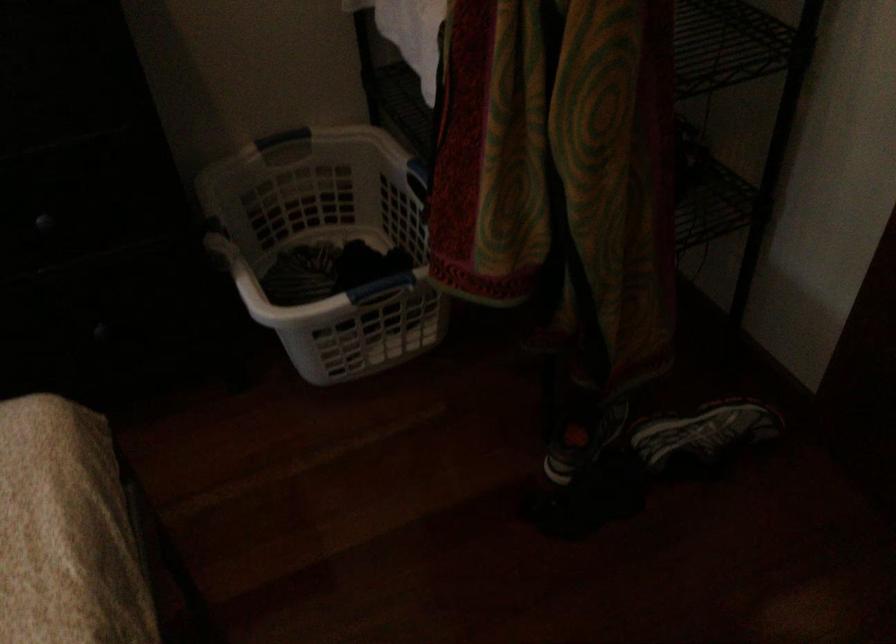
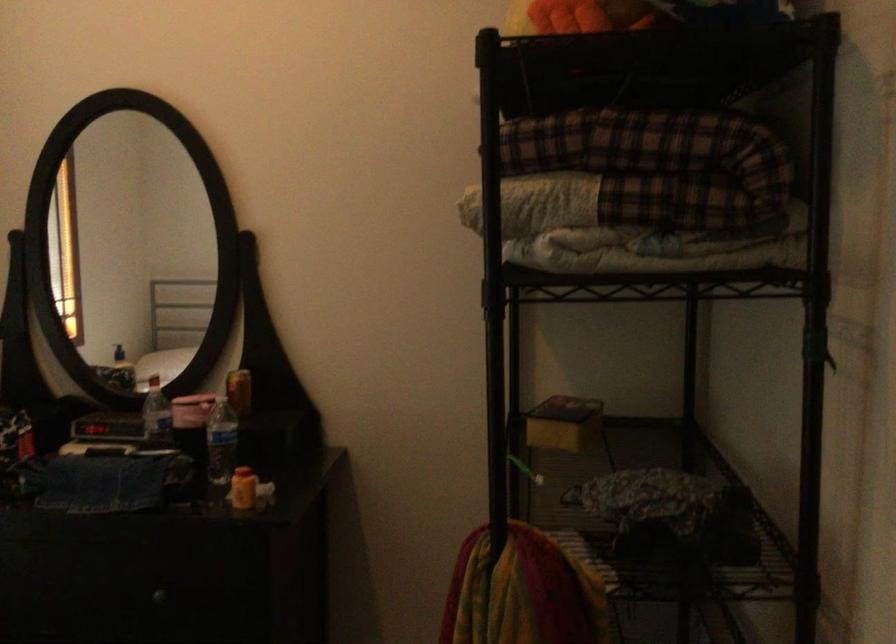
The first image is from the beginning of the video and the second image is from the end. How did the camera likely rotate when shooting the video?

The camera's rotation is toward left-up.